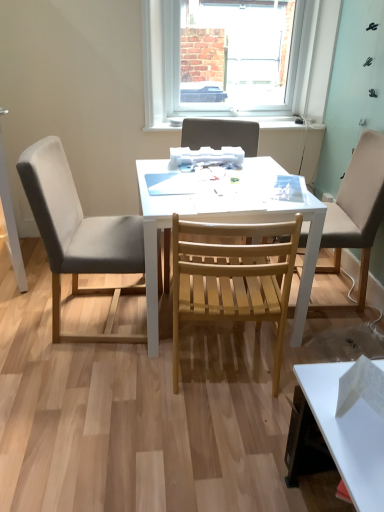
Question: Considering the positions of white plastic window at upper center and gray fabric chair at left, placed as the 1th chair when sorted from left to right, in the image, is white plastic window at upper center wider or thinner than gray fabric chair at left, placed as the 1th chair when sorted from left to right,?

Choices:
 (A) wide
 (B) thin

Answer: (B)

Question: Visually, is white plastic window at upper center positioned to the left or to the right of gray fabric chair at left, acting as the 4th chair starting from the right?

Choices:
 (A) left
 (B) right

Answer: (B)

Question: Estimate the real-world distances between objects in this image. Which object is closer to the wooden slatted chair at center, which is the third chair from right to left?

Choices:
 (A) white matte desk at center
 (B) gray fabric chair at left, placed as the 1th chair when sorted from left to right
 (C) natural wood chair at center, which is counted as the 2th chair, starting from the right
 (D) wooden slatted chair at center, the first chair when ordered from right to left
 (E) white plastic window at upper center

Answer: (A)

Question: Which object is positioned closest to the gray fabric chair at left, acting as the 4th chair starting from the right?

Choices:
 (A) white plastic window at upper center
 (B) natural wood chair at center, which is the 3th chair from left to right
 (C) wooden slatted chair at center, the first chair when ordered from right to left
 (D) wooden slatted chair at center, positioned as the second chair in left-to-right order
 (E) white matte desk at center

Answer: (E)